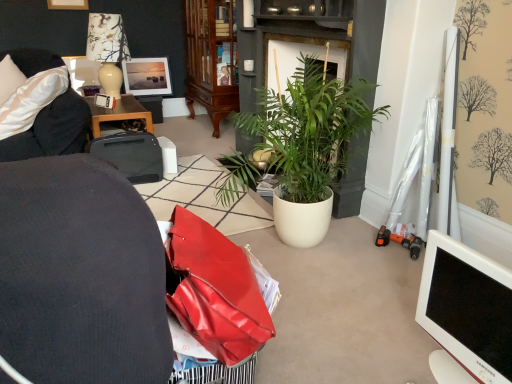
Question: From the image's perspective, is black plastic printer at center beneath green leafy plant at center?

Choices:
 (A) no
 (B) yes

Answer: (B)

Question: Can you confirm if black plastic printer at center is thinner than green leafy plant at center?

Choices:
 (A) no
 (B) yes

Answer: (B)

Question: Does black plastic printer at center have a greater width compared to green leafy plant at center?

Choices:
 (A) no
 (B) yes

Answer: (A)

Question: From a real-world perspective, is black plastic printer at center positioned over green leafy plant at center based on gravity?

Choices:
 (A) no
 (B) yes

Answer: (A)

Question: Considering the relative positions of black plastic printer at center and green leafy plant at center in the image provided, is black plastic printer at center to the right of green leafy plant at center from the viewer's perspective?

Choices:
 (A) yes
 (B) no

Answer: (B)

Question: From a real-world perspective, is black plastic printer at center positioned above or below mahogany glass-front cabinet at center?

Choices:
 (A) above
 (B) below

Answer: (B)

Question: Is point (103, 142) closer or farther from the camera than point (187, 59)?

Choices:
 (A) closer
 (B) farther

Answer: (A)

Question: Considering the positions of black plastic printer at center and mahogany glass-front cabinet at center in the image, is black plastic printer at center wider or thinner than mahogany glass-front cabinet at center?

Choices:
 (A) thin
 (B) wide

Answer: (A)

Question: In the image, is black plastic printer at center on the left side or the right side of mahogany glass-front cabinet at center?

Choices:
 (A) left
 (B) right

Answer: (A)

Question: Visually, is mahogany glass-front cabinet at center positioned to the left or to the right of green leafy plant at center?

Choices:
 (A) right
 (B) left

Answer: (B)

Question: From the image's perspective, relative to green leafy plant at center, is mahogany glass-front cabinet at center above or below?

Choices:
 (A) above
 (B) below

Answer: (A)

Question: Considering the positions of mahogany glass-front cabinet at center and green leafy plant at center in the image, is mahogany glass-front cabinet at center taller or shorter than green leafy plant at center?

Choices:
 (A) short
 (B) tall

Answer: (B)

Question: Based on their sizes in the image, would you say mahogany glass-front cabinet at center is bigger or smaller than green leafy plant at center?

Choices:
 (A) big
 (B) small

Answer: (B)

Question: Considering the positions of black plastic printer at upper left and black plastic printer at center in the image, is black plastic printer at upper left bigger or smaller than black plastic printer at center?

Choices:
 (A) small
 (B) big

Answer: (B)

Question: Considering the positions of black plastic printer at upper left and black plastic printer at center in the image, is black plastic printer at upper left wider or thinner than black plastic printer at center?

Choices:
 (A) thin
 (B) wide

Answer: (B)